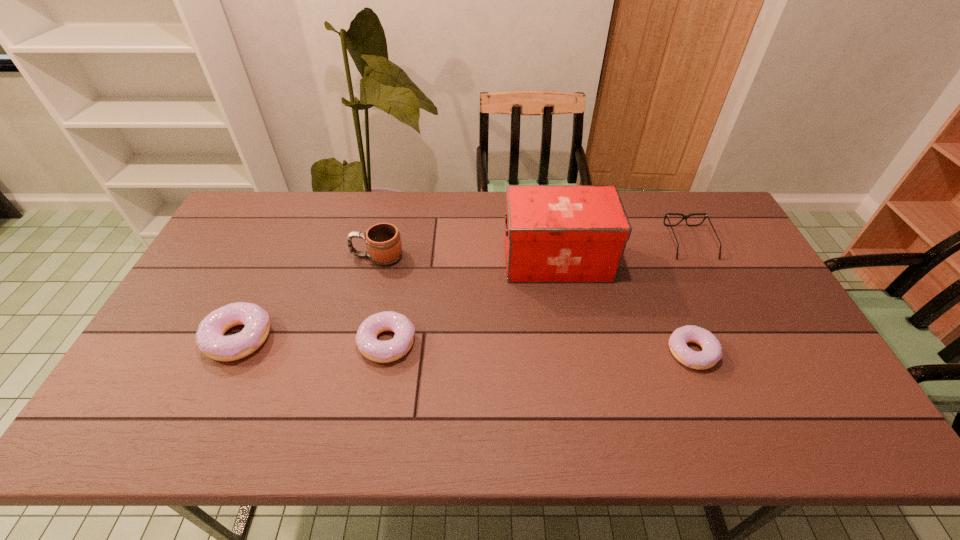
Where is `spot to insert another doughnut for uniform distribution`? The height and width of the screenshot is (540, 960). spot to insert another doughnut for uniform distribution is located at coordinates (539, 347).